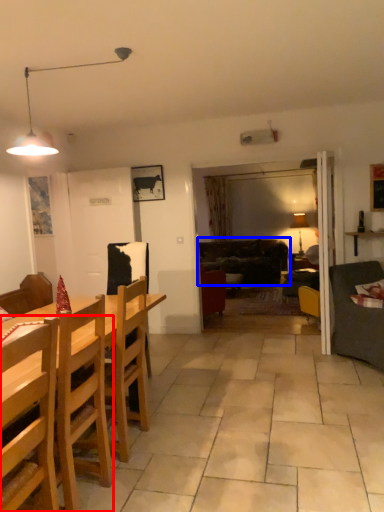
Question: Which object appears farthest to the camera in this image, chair (highlighted by a red box) or studio couch (highlighted by a blue box)?

Choices:
 (A) chair
 (B) studio couch

Answer: (B)